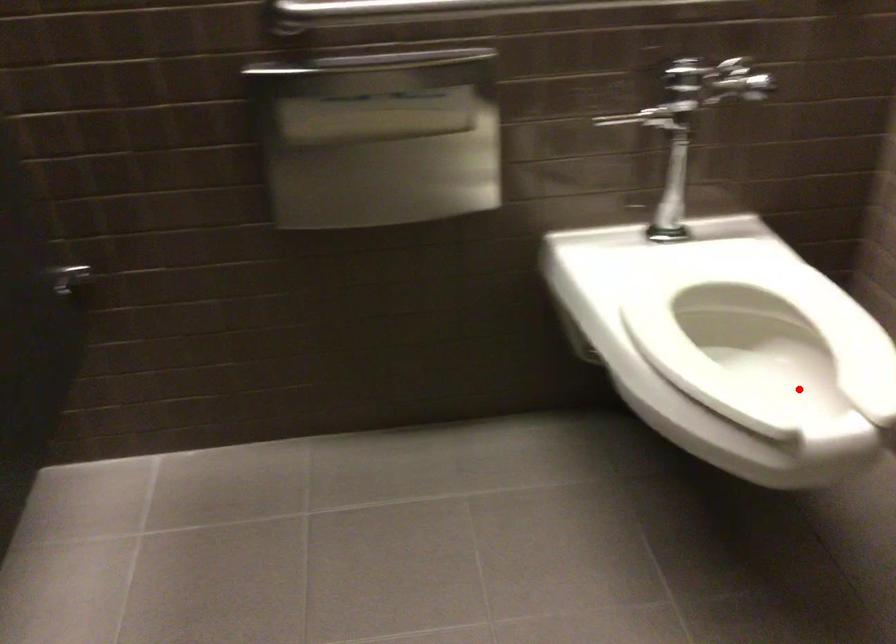
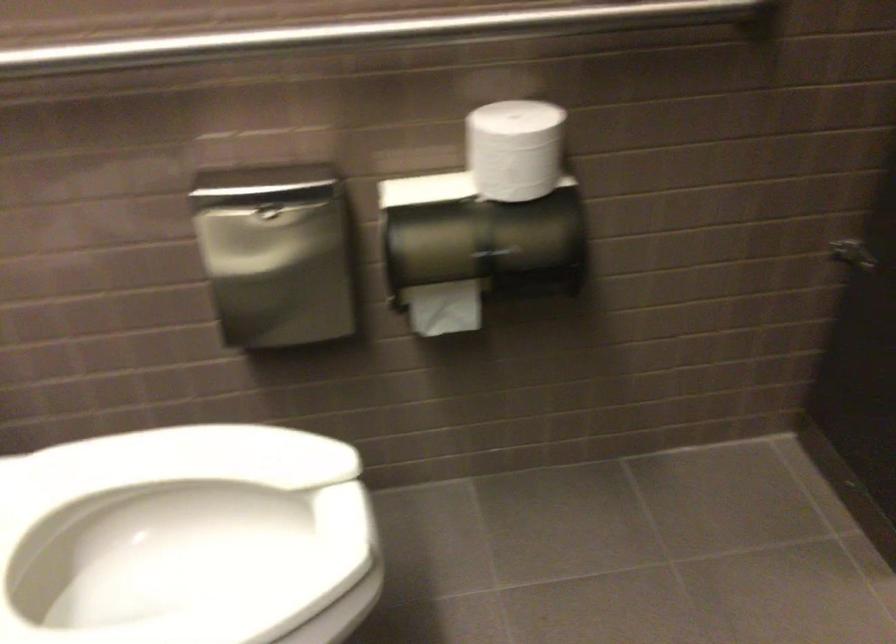
Find the pixel in the second image that matches the highlighted location in the first image.

(186, 538)